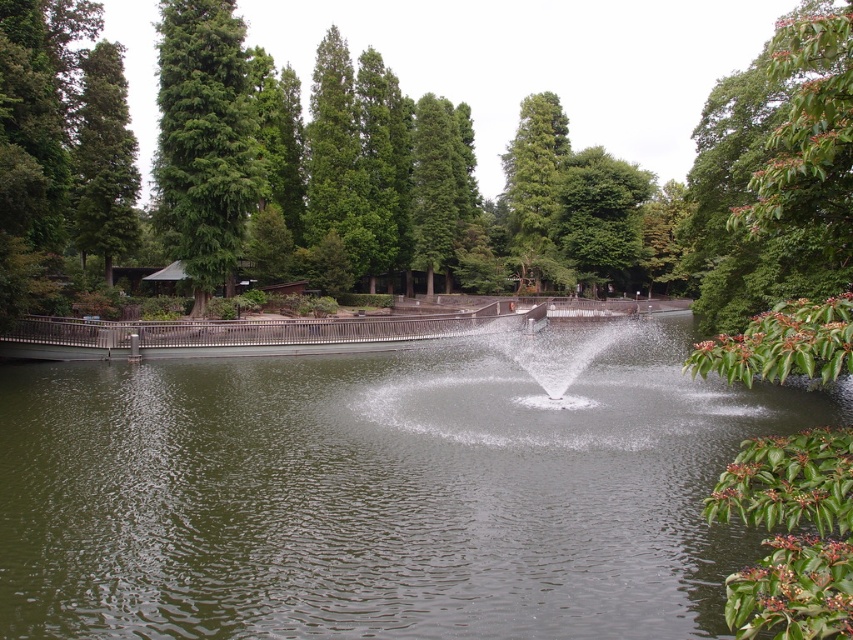
You are standing in the park and see the green leafy tree at upper center and the green matte tree at upper center. Which one appears to be taller?

The green leafy tree at upper center is smaller than the green matte tree at upper center, so the green matte tree at upper center is taller.

You are standing at the edge of the park pond and want to locate the clear water area. According to the coordinates provided, where would you find the clear water at center?

The clear water at center is located at coordinates point (381, 490).

You are a park visitor who wants to take a photo of the clear water at center and the green matte tree at upper center. Which object should you focus on first if you want to capture both in a single frame without moving your camera?

The clear water at center has a larger size compared to the green matte tree at upper center, so you should focus on the clear water at center first to ensure it fills the frame adequately before adjusting for the smaller green matte tree at upper center.